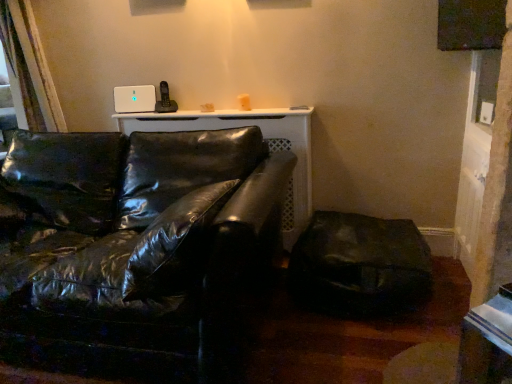
Identify the location of matte black window screen at upper right. click(x=470, y=24).

Locate an element on the screen. window screen that appears on the right of glossy black leather couch at center is located at coordinates (470, 24).

Looking at their sizes, would you say glossy black leather couch at center is wider or thinner than matte black window screen at upper right?

glossy black leather couch at center is wider than matte black window screen at upper right.

Is matte black window screen at upper right completely or partially inside glossy black leather couch at center?

No, glossy black leather couch at center does not contain matte black window screen at upper right.

Considering the relative sizes of glossy black leather couch at center and matte black swivel chair at lower right in the image provided, is glossy black leather couch at center taller than matte black swivel chair at lower right?

Correct, glossy black leather couch at center is much taller as matte black swivel chair at lower right.

Are glossy black leather couch at center and matte black swivel chair at lower right making contact?

glossy black leather couch at center is not next to matte black swivel chair at lower right, and they're not touching.

How many degrees apart are the facing directions of glossy black leather couch at center and matte black swivel chair at lower right?

The angle between the facing direction of glossy black leather couch at center and the facing direction of matte black swivel chair at lower right is 0.000291 degrees.

Considering the sizes of glossy black leather couch at center and matte black swivel chair at lower right in the image, is glossy black leather couch at center wider or thinner than matte black swivel chair at lower right?

Considering their sizes, glossy black leather couch at center looks broader than matte black swivel chair at lower right.

Considering the sizes of objects matte black swivel chair at lower right and matte black window screen at upper right in the image provided, who is shorter, matte black swivel chair at lower right or matte black window screen at upper right?

With less height is matte black window screen at upper right.

How different are the orientations of matte black swivel chair at lower right and matte black window screen at upper right in degrees?

88.3 degrees.

Which point is more distant from viewer, (393, 271) or (497, 27)?

The point (393, 271) is farther.

From a real-world perspective, is matte black swivel chair at lower right positioned above or below matte black window screen at upper right?

From a real-world perspective, matte black swivel chair at lower right is physically below matte black window screen at upper right.

Is matte black swivel chair at lower right bigger or smaller than glossy black leather couch at center?

Considering their sizes, matte black swivel chair at lower right takes up less space than glossy black leather couch at center.

Is glossy black leather couch at center a part of matte black swivel chair at lower right?

No, glossy black leather couch at center is not surrounded by matte black swivel chair at lower right.

Could you tell me if matte black swivel chair at lower right is turned towards glossy black leather couch at center?

Result: No, matte black swivel chair at lower right is not facing towards glossy black leather couch at center.

Is matte black window screen at upper right in front of matte black swivel chair at lower right?

Yes, it is.

Consider the image. Which of these two, matte black window screen at upper right or matte black swivel chair at lower right, stands taller?

matte black swivel chair at lower right is taller.

Is matte black window screen at upper right beside matte black swivel chair at lower right?

matte black window screen at upper right and matte black swivel chair at lower right are not in contact.

Between matte black window screen at upper right and matte black swivel chair at lower right, which one appears on the right side from the viewer's perspective?

From the viewer's perspective, matte black window screen at upper right appears more on the right side.

What's the angular difference between matte black window screen at upper right and glossy black leather couch at center's facing directions?

The angular difference between matte black window screen at upper right and glossy black leather couch at center is 88.3 degrees.

From the image's perspective, is matte black window screen at upper right beneath glossy black leather couch at center?

Actually, matte black window screen at upper right appears above glossy black leather couch at center in the image.

Can you see matte black window screen at upper right touching glossy black leather couch at center?

No.

Where is `window screen on the right of glossy black leather couch at center`? window screen on the right of glossy black leather couch at center is located at coordinates (470, 24).

The width and height of the screenshot is (512, 384). I want to click on studio couch below the matte black window screen at upper right (from a real-world perspective), so click(133, 247).

Where is `studio couch in front of the matte black swivel chair at lower right`? studio couch in front of the matte black swivel chair at lower right is located at coordinates (133, 247).

Which object lies further to the anchor point matte black window screen at upper right, glossy black leather couch at center or matte black swivel chair at lower right?

glossy black leather couch at center.

Considering their positions, is matte black swivel chair at lower right positioned closer to matte black window screen at upper right than glossy black leather couch at center?

The object closer to matte black window screen at upper right is matte black swivel chair at lower right.

Looking at the image, which one is located further to glossy black leather couch at center, matte black swivel chair at lower right or matte black window screen at upper right?

matte black window screen at upper right is positioned further to the anchor glossy black leather couch at center.

When comparing their distances from matte black swivel chair at lower right, does glossy black leather couch at center or matte black window screen at upper right seem closer?

glossy black leather couch at center.

Considering their positions, is matte black window screen at upper right positioned further to glossy black leather couch at center than matte black swivel chair at lower right?

matte black window screen at upper right is further to glossy black leather couch at center.

Looking at the image, which one is located closer to matte black swivel chair at lower right, matte black window screen at upper right or glossy black leather couch at center?

glossy black leather couch at center is positioned closer to the anchor matte black swivel chair at lower right.

You are a GUI agent. You are given a task and a screenshot of the screen. Output one action in this format:
    pyautogui.click(x=<x>, y=<y>)
    Task: Click on the swivel chair situated between glossy black leather couch at center and matte black window screen at upper right from left to right
    
    Given the screenshot: What is the action you would take?
    pyautogui.click(x=359, y=264)